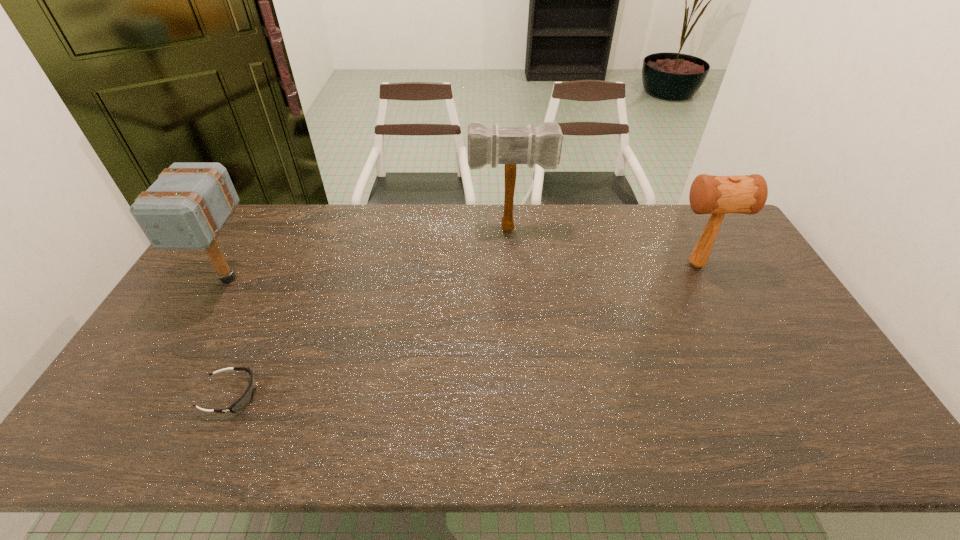
At what (x,y) coordinates should I click in order to perform the action: click on the third closest object to the farthest object. Please return your answer as a coordinate pair (x, y). The width and height of the screenshot is (960, 540). Looking at the image, I should click on (245, 399).

Identify which object is the second nearest to the goggles. Please provide its 2D coordinates. Your answer should be formatted as a tuple, i.e. [(x, y)], where the tuple contains the x and y coordinates of a point satisfying the conditions above.

[(494, 145)]

Choose which mallet is the second nearest neighbor to the farthest object. Please provide its 2D coordinates. Your answer should be formatted as a tuple, i.e. [(x, y)], where the tuple contains the x and y coordinates of a point satisfying the conditions above.

[(185, 208)]

Select which mallet appears as the closest to the farthest object. Please provide its 2D coordinates. Your answer should be formatted as a tuple, i.e. [(x, y)], where the tuple contains the x and y coordinates of a point satisfying the conditions above.

[(709, 194)]

This screenshot has height=540, width=960. Find the location of `vacant position in the image that satisfies the following two spatial constraints: 1. on the strike surface of the rightmost mallet; 2. on the striking surface of the leftmost object`. vacant position in the image that satisfies the following two spatial constraints: 1. on the strike surface of the rightmost mallet; 2. on the striking surface of the leftmost object is located at coordinates (703, 279).